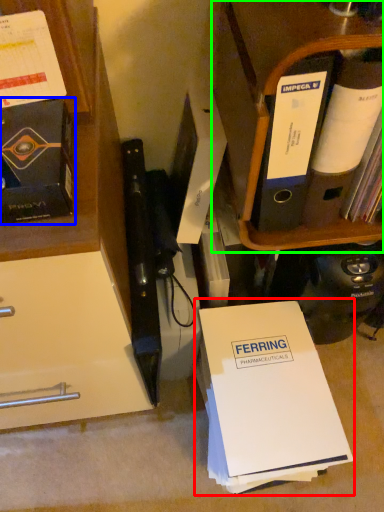
Question: Which object is the closest to the paperback book (highlighted by a red box)? Choose among these: book (highlighted by a blue box) or shelf (highlighted by a green box).

Choices:
 (A) book
 (B) shelf

Answer: (B)